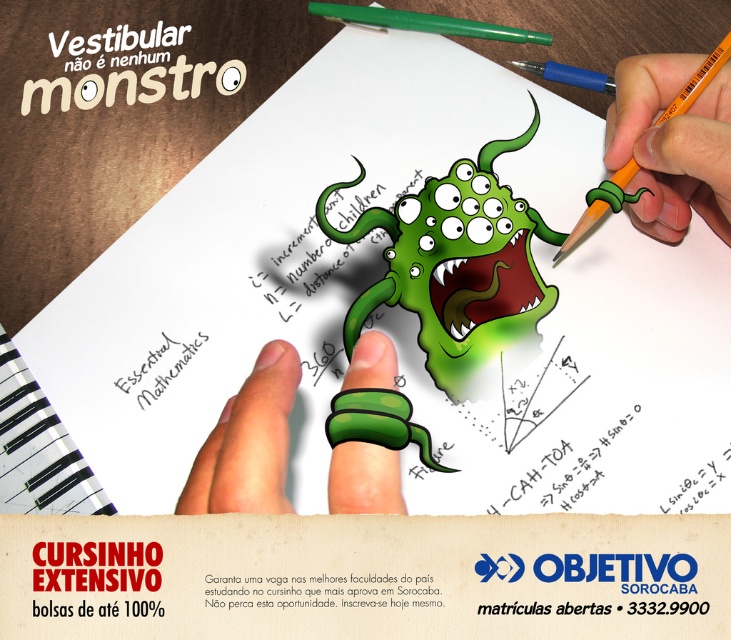
Question: Which of the following is the closest to the observer?

Choices:
 (A) (526, 246)
 (B) (723, 93)
 (C) (243, 387)

Answer: (C)

Question: Among these objects, which one is nearest to the camera?

Choices:
 (A) green plastic pencil at upper center
 (B) orange pencil at upper right

Answer: (B)

Question: Among these points, which one is farthest from the camera?

Choices:
 (A) (452, 390)
 (B) (659, 188)
 (C) (265, 404)
 (D) (602, 76)

Answer: (D)

Question: Does green matte monster at center have a lesser width compared to green rubber band at center?

Choices:
 (A) no
 (B) yes

Answer: (A)

Question: Is green plastic pencil at upper center positioned at the back of blue plastic pencil at upper center?

Choices:
 (A) yes
 (B) no

Answer: (A)

Question: Can you confirm if green rubber band at center is positioned to the left of blue plastic pencil at upper center?

Choices:
 (A) yes
 (B) no

Answer: (A)